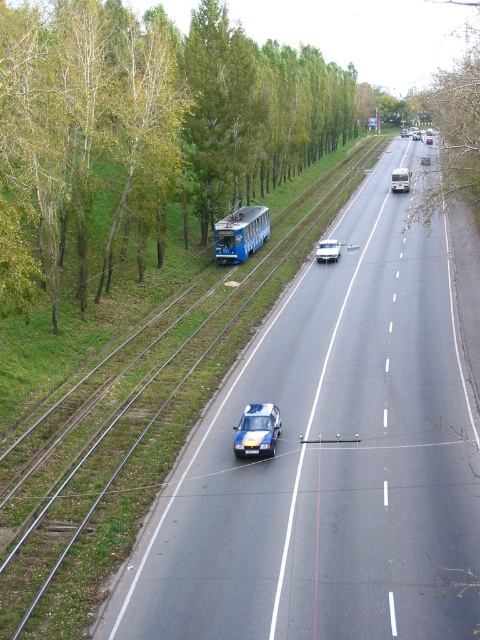
You are standing at the intersection near the tram track on the left side of the road. You want to locate the green leafy tree at upper right. In which direction should you look?

You should look towards the upper right direction to locate the green leafy tree at upper right, as it is positioned at point (456, 116) in the image.

You are a pedestrian standing at the intersection near the green leafy tree at upper left. You want to cross the road to reach the polished blue car at center. Considering their sizes, which object would be easier to spot from a distance?

The green leafy tree at upper left has a larger size compared to the polished blue car at center, so it would be easier to spot from a distance.